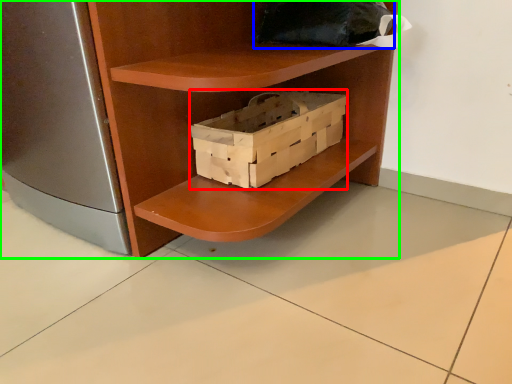
Question: Which is nearer to the box (highlighted by a red box)? pillow (highlighted by a blue box) or shelf (highlighted by a green box).

Choices:
 (A) pillow
 (B) shelf

Answer: (B)